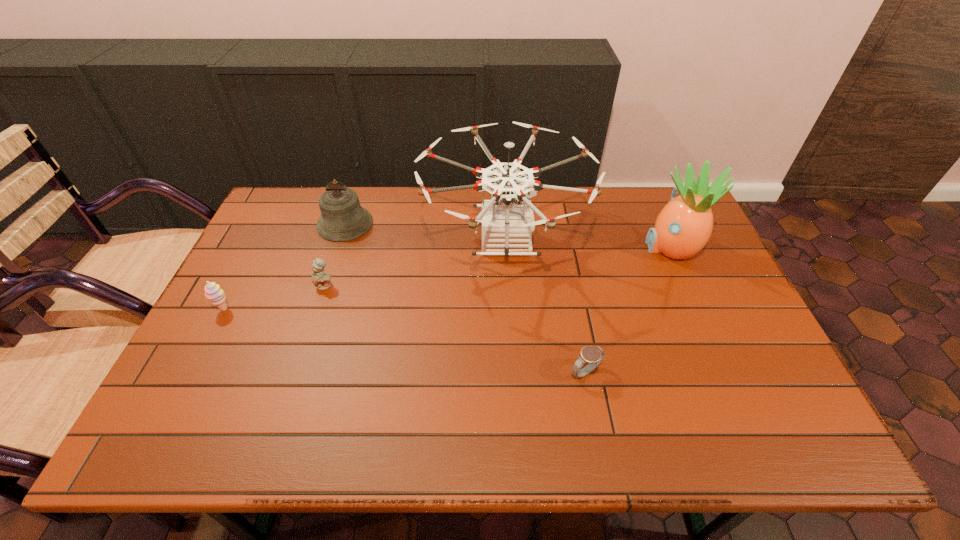
At what (x,y) coordinates should I click in order to perform the action: click on free space located at the entrance of the rightmost object. Please return your answer as a coordinate pair (x, y). The width and height of the screenshot is (960, 540). Looking at the image, I should click on click(x=600, y=247).

The image size is (960, 540). I want to click on free region located at the entrance of the rightmost object, so click(574, 247).

Find the location of a particular element. The height and width of the screenshot is (540, 960). vacant point located 0.080m on the back of the bell is located at coordinates (355, 193).

The image size is (960, 540). Identify the location of vacant space located on the right of the leftmost object. (343, 309).

The height and width of the screenshot is (540, 960). What are the coordinates of `vacant space located on the front-facing side of the teddy bear` in the screenshot? It's located at (319, 305).

Find the location of a particular element. The height and width of the screenshot is (540, 960). vacant region located on the back of the nearest object is located at coordinates (575, 317).

This screenshot has width=960, height=540. I want to click on drone at the far edge, so click(x=507, y=219).

Find the location of a particular element. The height and width of the screenshot is (540, 960). pineapple positioned at the far edge is located at coordinates (682, 229).

You are a GUI agent. You are given a task and a screenshot of the screen. Output one action in this format:
    pyautogui.click(x=<x>, y=<y>)
    Task: Click on the bell located in the far edge section of the desktop
    This screenshot has height=540, width=960.
    Given the screenshot: What is the action you would take?
    pyautogui.click(x=342, y=218)

Locate an element on the screen. The height and width of the screenshot is (540, 960). object located at the left edge is located at coordinates (213, 292).